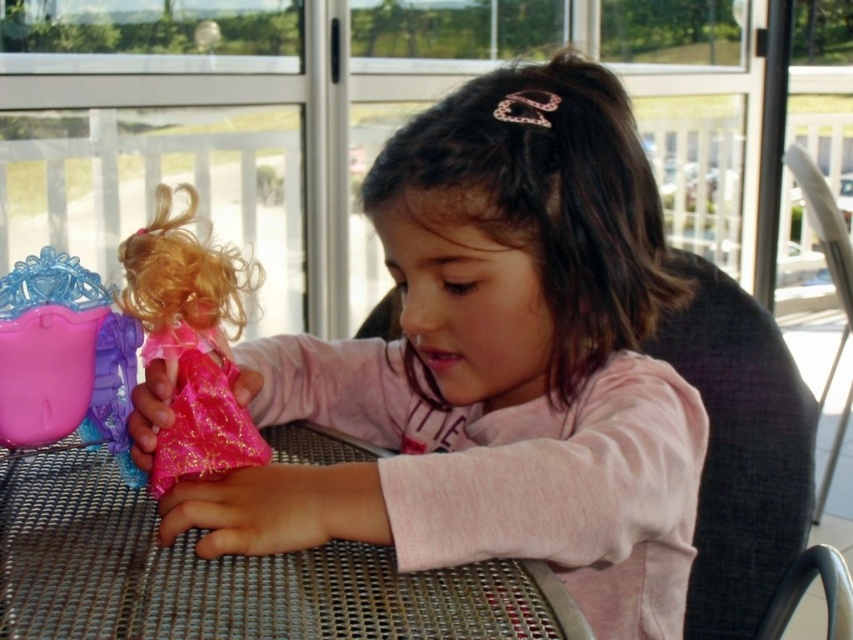
Question: Where is pink glitter doll at center located in relation to gray fabric chair at right in the image?

Choices:
 (A) above
 (B) below

Answer: (A)

Question: Observing the image, what is the correct spatial positioning of metallic mesh table at center in reference to shiny pink fabric doll at center?

Choices:
 (A) right
 (B) left

Answer: (A)

Question: Does shiny pink fabric doll at center appear on the right side of metallic silver chair at lower right?

Choices:
 (A) yes
 (B) no

Answer: (B)

Question: Which object is positioned closest to the pink glitter doll at center?

Choices:
 (A) shiny pink fabric doll at center
 (B) metallic mesh table at center
 (C) metallic silver chair at lower right

Answer: (B)

Question: Which of the following is the closest to the observer?

Choices:
 (A) metallic mesh table at center
 (B) gray fabric chair at right
 (C) shiny pink fabric doll at center
 (D) metallic silver chair at lower right

Answer: (A)

Question: Which object is positioned farthest from the gray fabric chair at right?

Choices:
 (A) metallic silver chair at lower right
 (B) pink glitter doll at center
 (C) metallic mesh table at center
 (D) shiny pink fabric doll at center

Answer: (D)